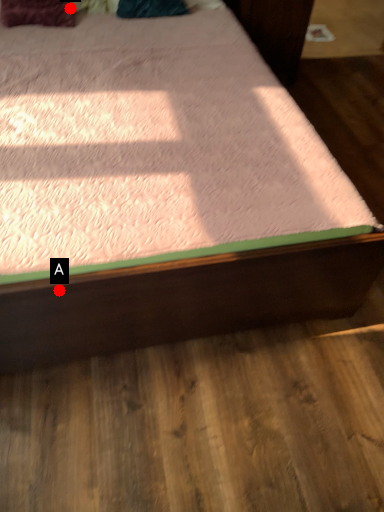
Question: Two points are circled on the image, labeled by A and B beside each circle. Which point is further to the camera?

Choices:
 (A) A is further
 (B) B is further

Answer: (B)